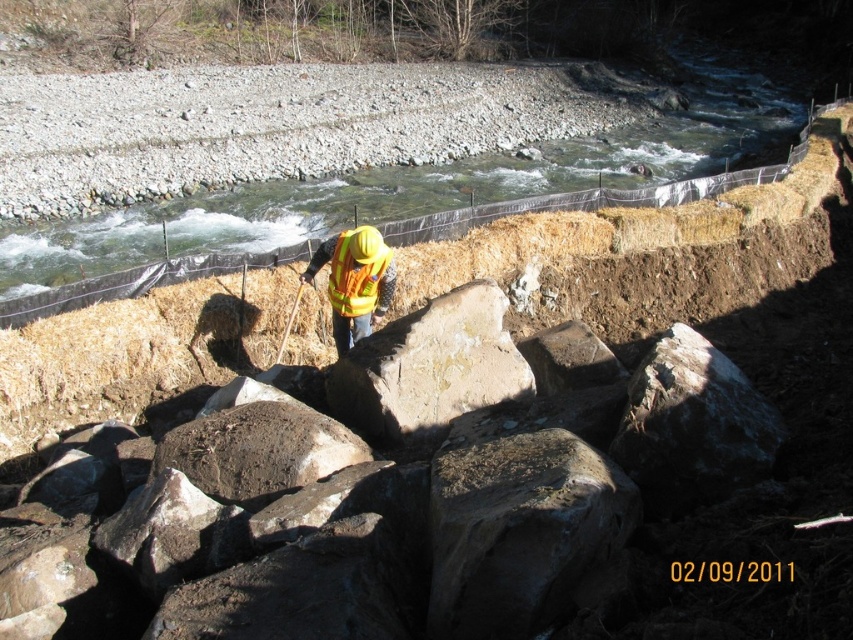
You are a safety inspector at the construction site near the river. You need to locate the point marked at coordinates (519,531). Where exactly is this point located?

The point marked at coordinates (519,531) is located on the rusty metallic rock at center.